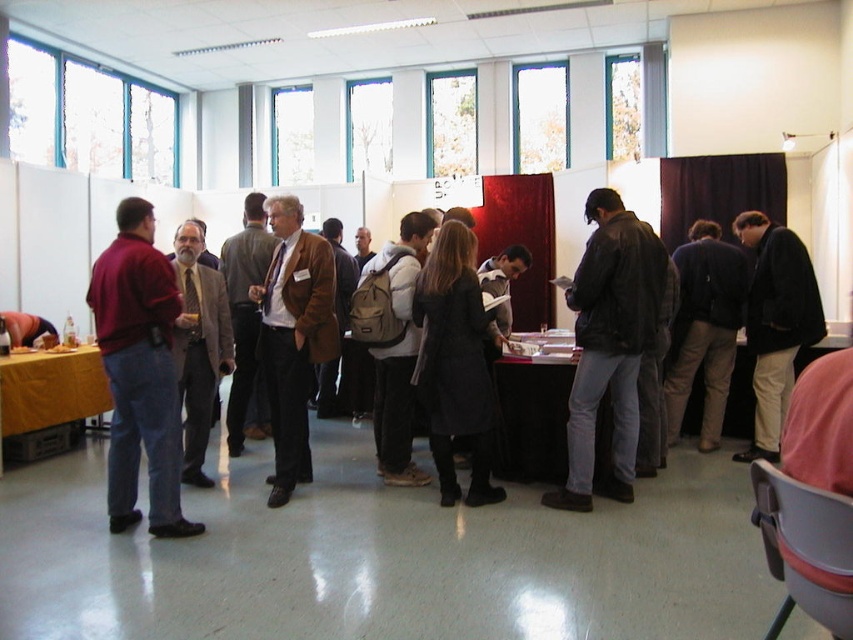
You are a photographer setting up a tripod in the middle of the room. You notice the brown textured suit at center and the khaki backpack at center. Which object is shorter and needs to be placed closer to the camera to avoid being hidden by the taller object?

The brown textured suit at center is shorter than the khaki backpack at center, so it should be placed closer to the camera to prevent it from being obscured by the taller khaki backpack at center.

Based on the photo, you are organizing a space for an event and need to place a new table between the black leather jacket at right and the khaki backpack at center. Which object should you move to make more room?

The black leather jacket at right occupies less space than the khaki backpack at center, so you should move the khaki backpack at center to create more space for the table.